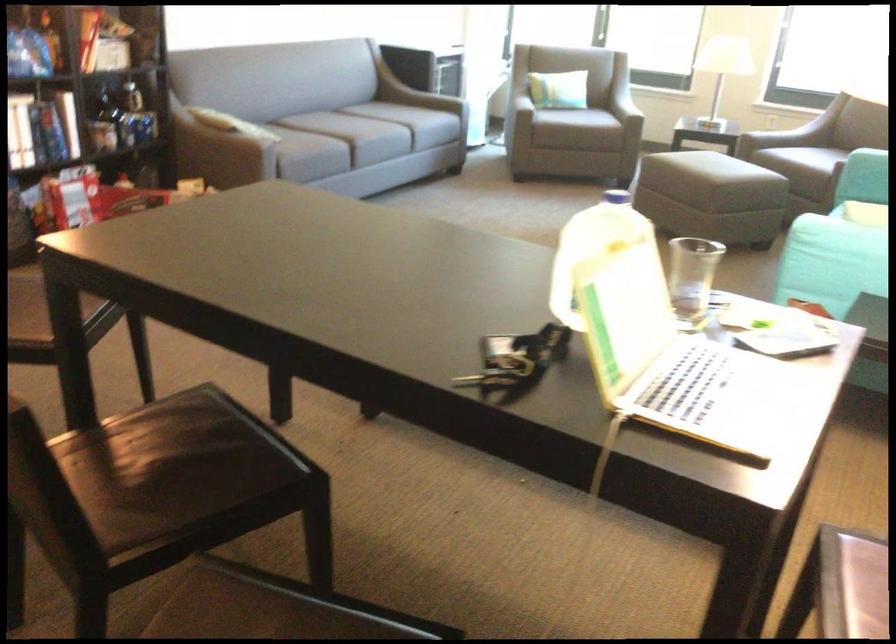
This screenshot has height=644, width=896. Describe the element at coordinates (343, 124) in the screenshot. I see `a sofa sitting surface` at that location.